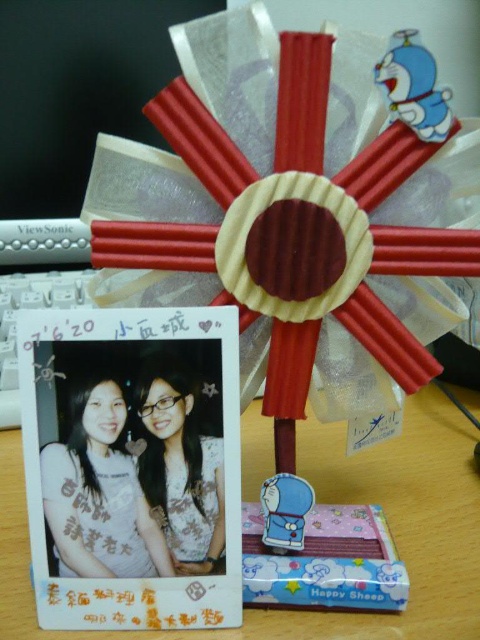
You are organizing a display and see the matte photo frame at center and the matte white blouse at center. Which object is located below the other?

The matte photo frame at center is positioned under the matte white blouse at center, so it is located below the blouse.

You are arranging items on a shelf and see the matte photo frame at center and the matte white blouse at center. Which item is positioned more to the left?

The matte photo frame at center is positioned more to the left than the matte white blouse at center.